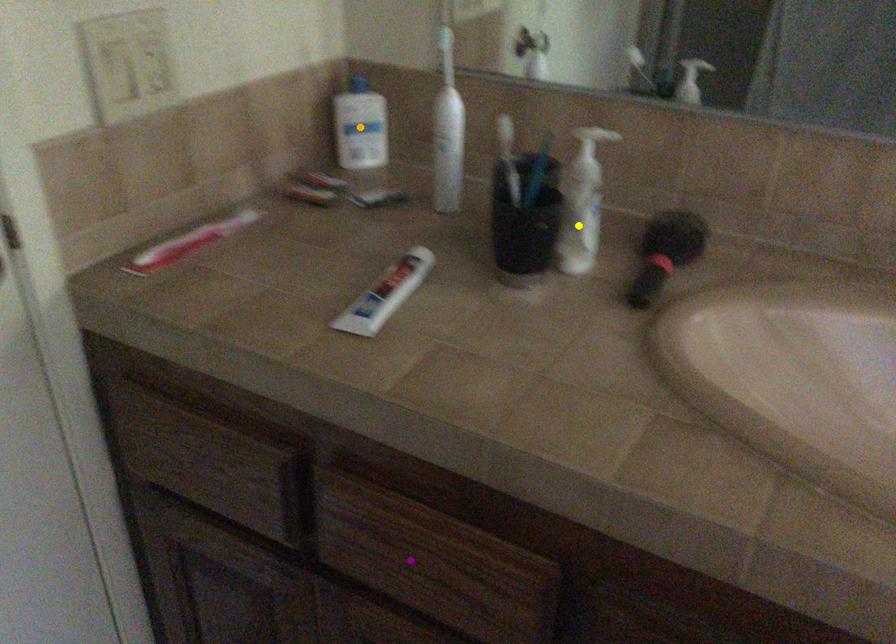
Order these from nearest to farthest:
- purple point
- orange point
- yellow point

purple point
yellow point
orange point